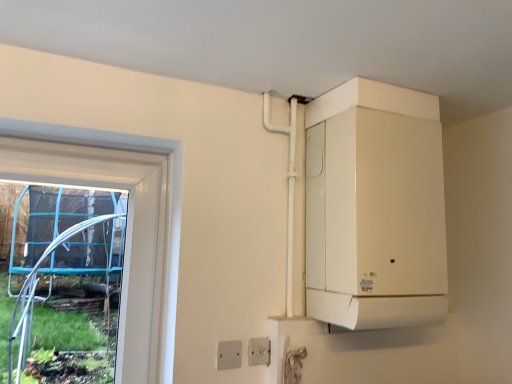
Question: Is white plastic electric outlet at lower center, which is the first electric outlet in left-to-right order, in front of white matte boiler at upper right?

Choices:
 (A) yes
 (B) no

Answer: (B)

Question: From a real-world perspective, does white plastic electric outlet at lower center, the first electric outlet when ordered from front to back, sit lower than white matte boiler at upper right?

Choices:
 (A) no
 (B) yes

Answer: (B)

Question: Is white plastic electric outlet at lower center, the 2th electric outlet positioned from the back, in contact with white matte boiler at upper right?

Choices:
 (A) no
 (B) yes

Answer: (A)

Question: From the image's perspective, is white plastic electric outlet at lower center, the 2th electric outlet positioned from the back, on white matte boiler at upper right?

Choices:
 (A) no
 (B) yes

Answer: (A)

Question: Is the position of white plastic electric outlet at lower center, which is counted as the second electric outlet, starting from the right, more distant than that of white matte boiler at upper right?

Choices:
 (A) yes
 (B) no

Answer: (A)

Question: Would you say white plastic electric outlet at lower center, which is counted as the second electric outlet, starting from the right, is inside or outside white plastic electric outlet at lower center, placed as the 2th electric outlet when sorted from front to back?

Choices:
 (A) outside
 (B) inside

Answer: (A)

Question: From a real-world perspective, relative to white plastic electric outlet at lower center, which ranks as the second electric outlet in left-to-right order, is white plastic electric outlet at lower center, which is counted as the second electric outlet, starting from the right, vertically above or below?

Choices:
 (A) below
 (B) above

Answer: (A)

Question: Is point (219, 362) closer or farther from the camera than point (249, 340)?

Choices:
 (A) farther
 (B) closer

Answer: (B)

Question: Is white plastic electric outlet at lower center, the first electric outlet when ordered from front to back, wider or thinner than white plastic electric outlet at lower center, marked as the 1th electric outlet in a back-to-front arrangement?

Choices:
 (A) thin
 (B) wide

Answer: (A)

Question: Relative to white plastic electric outlet at lower center, placed as the 2th electric outlet when sorted from front to back, is white matte boiler at upper right in front or behind?

Choices:
 (A) behind
 (B) front

Answer: (B)

Question: Based on their sizes in the image, would you say white matte boiler at upper right is bigger or smaller than white plastic electric outlet at lower center, the 1th electric outlet from the right?

Choices:
 (A) big
 (B) small

Answer: (A)

Question: From the image's perspective, is white matte boiler at upper right above or below white plastic electric outlet at lower center, which ranks as the second electric outlet in left-to-right order?

Choices:
 (A) below
 (B) above

Answer: (B)

Question: Is point tap(381, 241) closer or farther from the camera than point tap(257, 350)?

Choices:
 (A) farther
 (B) closer

Answer: (B)

Question: In the image, is white plastic electric outlet at lower center, marked as the 1th electric outlet in a back-to-front arrangement, positioned in front of or behind white plastic electric outlet at lower center, which is the first electric outlet in left-to-right order?

Choices:
 (A) behind
 (B) front

Answer: (A)

Question: Based on their positions, is white plastic electric outlet at lower center, the 1th electric outlet from the right, located to the left or right of white plastic electric outlet at lower center, the first electric outlet when ordered from front to back?

Choices:
 (A) right
 (B) left

Answer: (A)